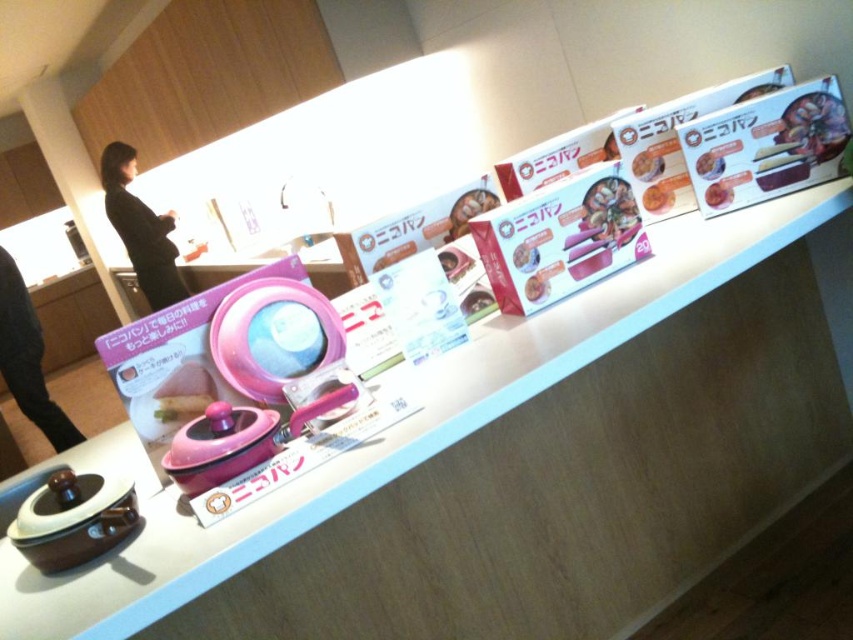
Question: Estimate the real-world distances between objects in this image. Which object is farther from the matte pink rice cooker at upper center?

Choices:
 (A) black fabric man at lower left
 (B) black fabric at left

Answer: (B)

Question: Among these objects, which one is farthest from the camera?

Choices:
 (A) matte pink rice cooker at upper center
 (B) black fabric man at lower left

Answer: (B)

Question: Which of the following is the farthest from the observer?

Choices:
 (A) black fabric man at lower left
 (B) matte pink rice cooker at upper center
 (C) white glossy counter top at upper center

Answer: (A)

Question: Is white glossy counter top at upper center behind matte pink rice cooker at upper center?

Choices:
 (A) no
 (B) yes

Answer: (A)

Question: Can you confirm if white glossy counter top at upper center is positioned above matte pink rice cooker at upper center?

Choices:
 (A) no
 (B) yes

Answer: (A)

Question: In this image, where is black fabric at left located relative to matte pink rice cooker at upper center?

Choices:
 (A) below
 (B) above

Answer: (B)